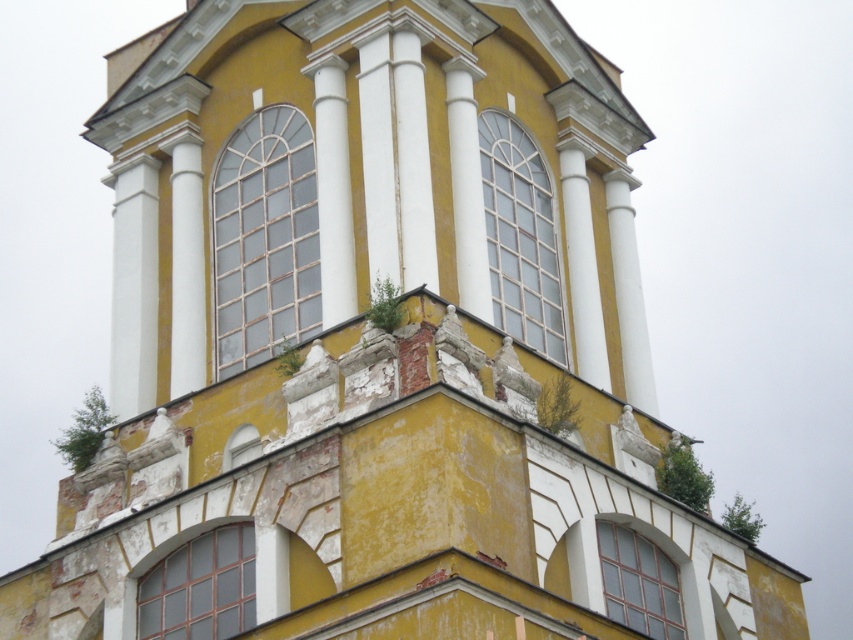
Question: Can you confirm if clear glass window at center is positioned to the left of matte glass window at lower center?

Choices:
 (A) no
 (B) yes

Answer: (A)

Question: Does matte glass window at center have a lesser width compared to clear glass window at lower right?

Choices:
 (A) yes
 (B) no

Answer: (B)

Question: Which point is farther to the camera?

Choices:
 (A) matte glass window at lower center
 (B) clear glass window at center
 (C) clear glass window at lower right
 (D) matte glass window at center

Answer: (B)

Question: Which point appears farthest from the camera in this image?

Choices:
 (A) (613, 589)
 (B) (547, 268)
 (C) (265, 136)

Answer: (B)

Question: Does matte glass window at lower center have a smaller size compared to clear glass window at lower right?

Choices:
 (A) no
 (B) yes

Answer: (A)

Question: Which of the following is the closest to the observer?

Choices:
 (A) clear glass window at center
 (B) clear glass window at lower right

Answer: (B)